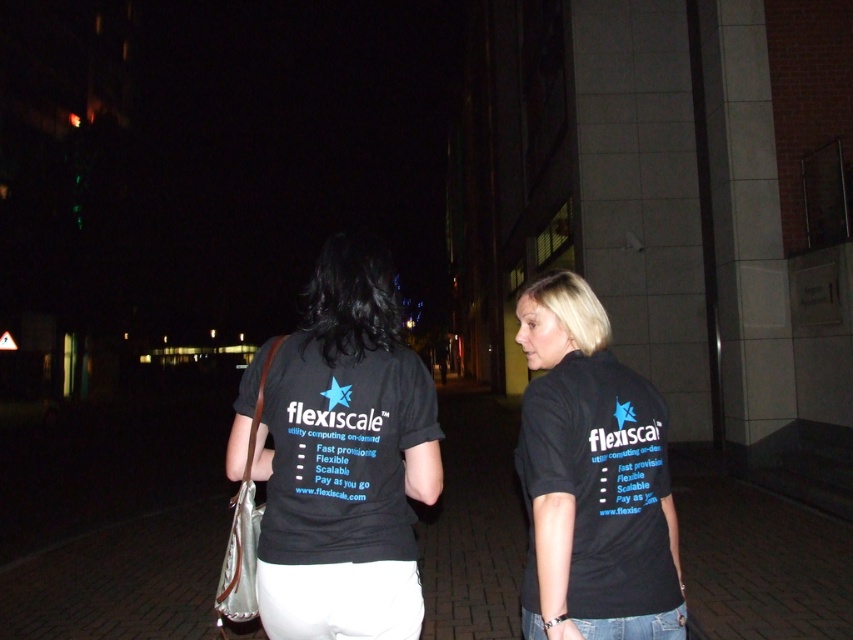
You are a photographer trying to focus on two points in the image. The first point is at coordinate point [532,408] and the second is at point [381,346]. Which point should you focus on first if you want to start with the one closer to the camera?

Point [532,408] is closer to the camera than point [381,346], so you should focus on point [532,408] first.